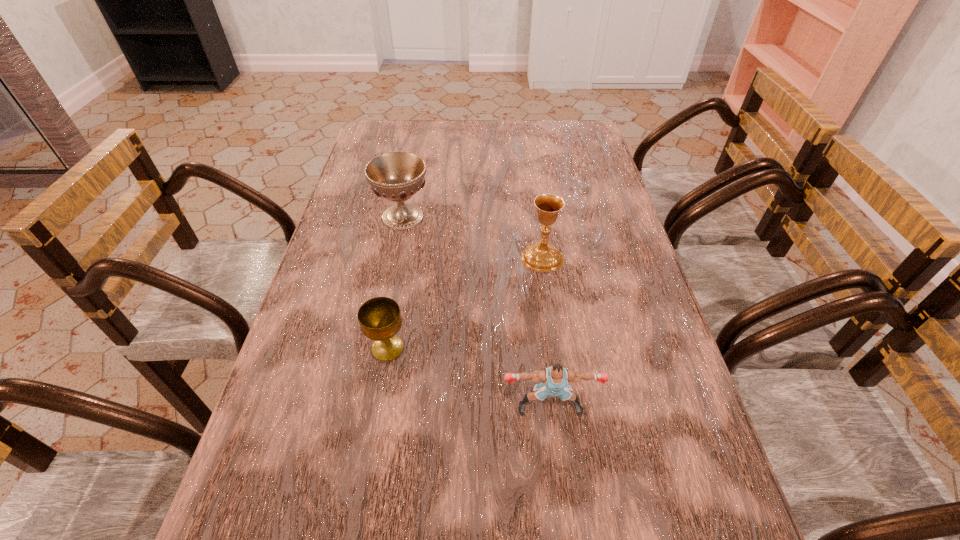
You are a GUI agent. You are given a task and a screenshot of the screen. Output one action in this format:
    pyautogui.click(x=<x>, y=<y>)
    Task: Click on the rightmost chalice
    This screenshot has height=540, width=960.
    Given the screenshot: What is the action you would take?
    pyautogui.click(x=541, y=256)

The height and width of the screenshot is (540, 960). I want to click on the second nearest chalice, so click(x=541, y=256).

Identify the location of the farthest object. The height and width of the screenshot is (540, 960). pyautogui.click(x=397, y=176).

Image resolution: width=960 pixels, height=540 pixels. I want to click on puncher, so [556, 379].

Find the location of a particular element. Image resolution: width=960 pixels, height=540 pixels. the shortest object is located at coordinates (380, 319).

At what (x,y) coordinates should I click in order to perform the action: click on the nearest chalice. Please return your answer as a coordinate pair (x, y). Image resolution: width=960 pixels, height=540 pixels. Looking at the image, I should click on (380, 319).

The height and width of the screenshot is (540, 960). What are the coordinates of `free space located on the front of the second farthest object` in the screenshot? It's located at (559, 373).

This screenshot has width=960, height=540. Identify the location of free spot located on the back of the farthest object. (417, 146).

The image size is (960, 540). In order to click on free region located 0.100m on the front-facing side of the nearest object in this screenshot , I will do `click(557, 471)`.

Locate an element on the screen. This screenshot has height=540, width=960. vacant position located 0.190m on the right of the second nearest object is located at coordinates (495, 348).